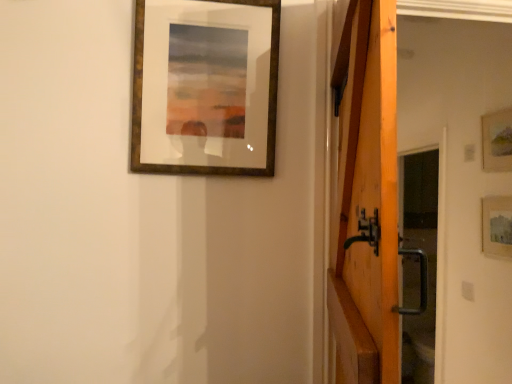
Find the location of `wooden frame at upper center, placed as the first picture frame when sorted from left to right`. wooden frame at upper center, placed as the first picture frame when sorted from left to right is located at coordinates (205, 87).

This screenshot has width=512, height=384. Describe the element at coordinates (497, 226) in the screenshot. I see `matte wooden picture frame at right, arranged as the second picture frame when viewed from the right` at that location.

The image size is (512, 384). Identify the location of wooden frame at upper center, the 3th picture frame when ordered from right to left. (205, 87).

From a real-world perspective, who is located higher, wooden barn door at right or wooden frame at upper center, placed as the first picture frame when sorted from left to right?

From a 3D spatial view, wooden frame at upper center, placed as the first picture frame when sorted from left to right, is above.

Can wooden frame at upper center, which is the third picture frame in back-to-front order, be found inside wooden barn door at right?

No.

Is wooden barn door at right far from wooden frame at upper center, which is the first picture frame in front-to-back order?

wooden barn door at right is actually quite close to wooden frame at upper center, which is the first picture frame in front-to-back order.

How different are the orientations of wooden barn door at right and wooden frame at upper center, placed as the first picture frame when sorted from left to right, in degrees?

The angular difference between wooden barn door at right and wooden frame at upper center, placed as the first picture frame when sorted from left to right, is 76.2 degrees.

Is matte wooden picture frame at right, arranged as the second picture frame when viewed from the right, next to wooden frame at upper center, placed as the first picture frame when sorted from left to right, and touching it?

No, matte wooden picture frame at right, arranged as the second picture frame when viewed from the right, is not touching wooden frame at upper center, placed as the first picture frame when sorted from left to right.

Based on the photo, can you confirm if matte wooden picture frame at right, marked as the second picture frame in a left-to-right arrangement, is positioned to the left of wooden frame at upper center, placed as the first picture frame when sorted from left to right?

No, matte wooden picture frame at right, marked as the second picture frame in a left-to-right arrangement, is not to the left of wooden frame at upper center, placed as the first picture frame when sorted from left to right.

Is matte wooden picture frame at right, arranged as the 3th picture frame when viewed from the front, closer to the viewer compared to wooden frame at upper center, which is the third picture frame in back-to-front order?

No, matte wooden picture frame at right, arranged as the 3th picture frame when viewed from the front, is further to the viewer.

Is matte wooden picture frame at right, marked as the second picture frame in a left-to-right arrangement, aimed at wooden frame at upper center, placed as the first picture frame when sorted from left to right?

Yes.

From the image's perspective, between wooden frame at upper center, placed as the first picture frame when sorted from left to right, and wooden barn door at right, which one is located above?

wooden frame at upper center, placed as the first picture frame when sorted from left to right, is shown above in the image.

Is wooden frame at upper center, which is the third picture frame in back-to-front order, turned away from wooden barn door at right?

No, wooden frame at upper center, which is the third picture frame in back-to-front order,'s orientation is not away from wooden barn door at right.

Based on the photo, considering the sizes of objects wooden frame at upper center, which is the third picture frame in back-to-front order, and wooden barn door at right in the image provided, who is bigger, wooden frame at upper center, which is the third picture frame in back-to-front order, or wooden barn door at right?

wooden barn door at right.

Which of these two, wooden picture frame at upper right, which ranks as the second picture frame in back-to-front order, or wooden frame at upper center, which is the third picture frame in back-to-front order, is thinner?

wooden picture frame at upper right, which ranks as the second picture frame in back-to-front order.

Is there a large distance between wooden picture frame at upper right, arranged as the second picture frame when viewed from the front, and wooden frame at upper center, placed as the first picture frame when sorted from left to right?

Yes.

In the scene shown: Between wooden picture frame at upper right, arranged as the second picture frame when viewed from the front, and wooden frame at upper center, which is the first picture frame in front-to-back order, which one has smaller size?

wooden picture frame at upper right, arranged as the second picture frame when viewed from the front.

Is wooden picture frame at upper right, arranged as the 1th picture frame when viewed from the right, looking in the opposite direction of wooden barn door at right?

No, wooden picture frame at upper right, arranged as the 1th picture frame when viewed from the right,'s orientation is not away from wooden barn door at right.

Identify the location of barn door lying on the left of wooden picture frame at upper right, arranged as the second picture frame when viewed from the front. (367, 199).

Looking at their sizes, would you say wooden picture frame at upper right, arranged as the 1th picture frame when viewed from the right, is wider or thinner than wooden barn door at right?

Considering their sizes, wooden picture frame at upper right, arranged as the 1th picture frame when viewed from the right, looks slimmer than wooden barn door at right.

Does wooden picture frame at upper right, arranged as the second picture frame when viewed from the front, have a smaller size compared to wooden barn door at right?

Indeed, wooden picture frame at upper right, arranged as the second picture frame when viewed from the front, has a smaller size compared to wooden barn door at right.

Is wooden barn door at right facing towards matte wooden picture frame at right, marked as the second picture frame in a left-to-right arrangement?

No, wooden barn door at right is not turned towards matte wooden picture frame at right, marked as the second picture frame in a left-to-right arrangement.

Is wooden barn door at right far from matte wooden picture frame at right, arranged as the 3th picture frame when viewed from the front?

Yes, wooden barn door at right is far from matte wooden picture frame at right, arranged as the 3th picture frame when viewed from the front.

From a real-world perspective, which object stands above the other?

wooden barn door at right is physically above.

Is wooden picture frame at upper right, which ranks as the 3th picture frame in left-to-right order, spatially inside matte wooden picture frame at right, arranged as the 3th picture frame when viewed from the front, or outside of it?

wooden picture frame at upper right, which ranks as the 3th picture frame in left-to-right order, lies outside matte wooden picture frame at right, arranged as the 3th picture frame when viewed from the front.

Which object is closer to the camera, wooden picture frame at upper right, which ranks as the 3th picture frame in left-to-right order, or matte wooden picture frame at right, arranged as the 3th picture frame when viewed from the front?

wooden picture frame at upper right, which ranks as the 3th picture frame in left-to-right order.

Considering the positions of objects wooden picture frame at upper right, arranged as the 1th picture frame when viewed from the right, and matte wooden picture frame at right, arranged as the 3th picture frame when viewed from the front, in the image provided, who is more to the right, wooden picture frame at upper right, arranged as the 1th picture frame when viewed from the right, or matte wooden picture frame at right, arranged as the 3th picture frame when viewed from the front,?

From the viewer's perspective, wooden picture frame at upper right, arranged as the 1th picture frame when viewed from the right, appears more on the right side.

In the image, there is a wooden frame at upper center, which is the third picture frame in back-to-front order. At what (x,y) coordinates should I click in order to perform the action: click on barn door below it (from a real-world perspective). Please return your answer as a coordinate pair (x, y). Looking at the image, I should click on (367, 199).

Where is `the 1st picture frame to the right of the wooden frame at upper center, which is the third picture frame in back-to-front order, starting your count from the anchor`? This screenshot has width=512, height=384. the 1st picture frame to the right of the wooden frame at upper center, which is the third picture frame in back-to-front order, starting your count from the anchor is located at coordinates (497, 226).

From the image, which object appears to be farther from matte wooden picture frame at right, marked as the second picture frame in a left-to-right arrangement, wooden barn door at right or wooden picture frame at upper right, which ranks as the 3th picture frame in left-to-right order?

wooden barn door at right is further to matte wooden picture frame at right, marked as the second picture frame in a left-to-right arrangement.

Based on the photo, looking at the image, which one is located further to wooden frame at upper center, placed as the first picture frame when sorted from left to right, wooden picture frame at upper right, arranged as the 1th picture frame when viewed from the right, or wooden barn door at right?

wooden picture frame at upper right, arranged as the 1th picture frame when viewed from the right, lies further to wooden frame at upper center, placed as the first picture frame when sorted from left to right, than the other object.

Based on their spatial positions, is wooden frame at upper center, placed as the first picture frame when sorted from left to right, or matte wooden picture frame at right, arranged as the second picture frame when viewed from the right, closer to wooden picture frame at upper right, which ranks as the second picture frame in back-to-front order?

matte wooden picture frame at right, arranged as the second picture frame when viewed from the right, is positioned closer to the anchor wooden picture frame at upper right, which ranks as the second picture frame in back-to-front order.

Which object lies nearer to the anchor point wooden barn door at right, wooden frame at upper center, which is the third picture frame in back-to-front order, or wooden picture frame at upper right, which ranks as the 3th picture frame in left-to-right order?

Among the two, wooden frame at upper center, which is the third picture frame in back-to-front order, is located nearer to wooden barn door at right.

When comparing their distances from wooden frame at upper center, which is the first picture frame in front-to-back order, does wooden barn door at right or matte wooden picture frame at right, arranged as the 3th picture frame when viewed from the front, seem further?

matte wooden picture frame at right, arranged as the 3th picture frame when viewed from the front, is further to wooden frame at upper center, which is the first picture frame in front-to-back order.

Considering their positions, is wooden picture frame at upper right, arranged as the second picture frame when viewed from the front, positioned further to wooden barn door at right than matte wooden picture frame at right, acting as the first picture frame starting from the back?

Based on the image, wooden picture frame at upper right, arranged as the second picture frame when viewed from the front, appears to be further to wooden barn door at right.

From the image, which object appears to be nearer to wooden barn door at right, matte wooden picture frame at right, acting as the first picture frame starting from the back, or wooden picture frame at upper right, which ranks as the 3th picture frame in left-to-right order?

Based on the image, matte wooden picture frame at right, acting as the first picture frame starting from the back, appears to be nearer to wooden barn door at right.

Which object lies further to the anchor point wooden barn door at right, wooden frame at upper center, which is the first picture frame in front-to-back order, or matte wooden picture frame at right, arranged as the 3th picture frame when viewed from the front?

The object further to wooden barn door at right is matte wooden picture frame at right, arranged as the 3th picture frame when viewed from the front.

Image resolution: width=512 pixels, height=384 pixels. I want to click on barn door between wooden frame at upper center, placed as the first picture frame when sorted from left to right, and wooden picture frame at upper right, arranged as the second picture frame when viewed from the front, from left to right, so click(x=367, y=199).

Find the location of a particular element. Image resolution: width=512 pixels, height=384 pixels. picture frame between wooden frame at upper center, placed as the first picture frame when sorted from left to right, and wooden picture frame at upper right, which ranks as the second picture frame in back-to-front order is located at coordinates pyautogui.click(x=497, y=226).

The height and width of the screenshot is (384, 512). Find the location of `barn door between wooden frame at upper center, which is the third picture frame in back-to-front order, and matte wooden picture frame at right, arranged as the second picture frame when viewed from the right, in the horizontal direction`. barn door between wooden frame at upper center, which is the third picture frame in back-to-front order, and matte wooden picture frame at right, arranged as the second picture frame when viewed from the right, in the horizontal direction is located at coordinates (367, 199).